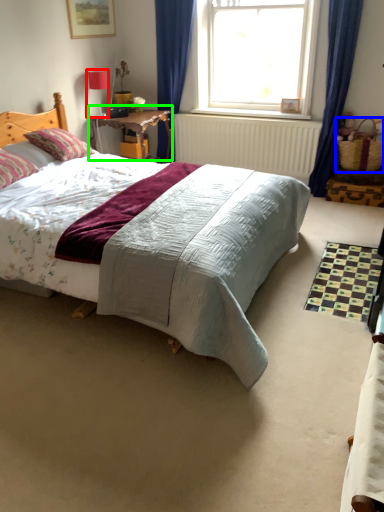
Question: Which object is the closest to the lamp (highlighted by a red box)? Choose among these: picnic basket (highlighted by a blue box) or table (highlighted by a green box).

Choices:
 (A) picnic basket
 (B) table

Answer: (B)